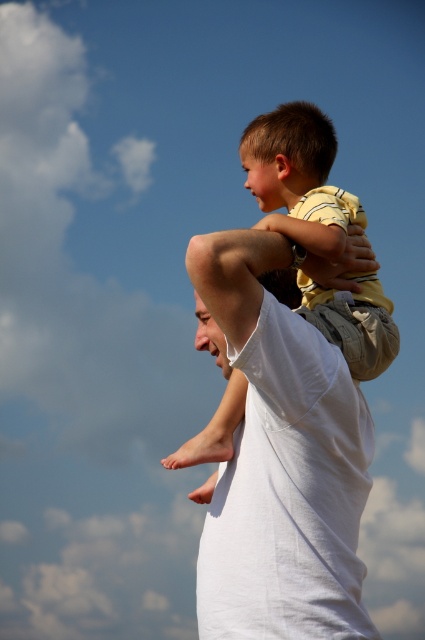
Question: Which object appears closest to the camera in this image?

Choices:
 (A) light brown cotton shirt at center
 (B) white cotton shirt at center

Answer: (B)

Question: Does white cotton shirt at center have a larger size compared to light brown cotton shirt at center?

Choices:
 (A) no
 (B) yes

Answer: (A)

Question: Observing the image, what is the correct spatial positioning of white cotton shirt at center in reference to light brown cotton shirt at center?

Choices:
 (A) below
 (B) above

Answer: (A)

Question: Which point is farther to the camera?

Choices:
 (A) (363, 435)
 (B) (288, 202)

Answer: (B)

Question: Is white cotton shirt at center below light brown cotton shirt at center?

Choices:
 (A) yes
 (B) no

Answer: (A)